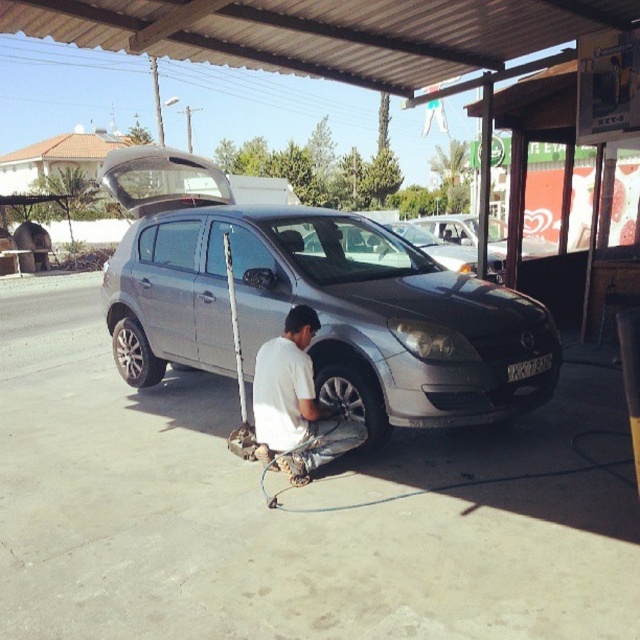
Between satin silver car at center and black plastic license plate at front, which one has less height?

Standing shorter between the two is black plastic license plate at front.

Based on the photo, which is below, satin silver car at center or black plastic license plate at front?

black plastic license plate at front is below.

Where is `satin silver car at center`? This screenshot has height=640, width=640. satin silver car at center is located at coordinates (316, 294).

The width and height of the screenshot is (640, 640). Identify the location of satin silver car at center. (316, 294).

Between black rubber tire at lower center and black plastic license plate at front, which one has less height?

Standing shorter between the two is black plastic license plate at front.

Locate an element on the screen. This screenshot has width=640, height=640. black rubber tire at lower center is located at coordinates (355, 397).

Is white matte shirt at lower center to the right of silver metallic tire at lower left from the viewer's perspective?

Yes, white matte shirt at lower center is to the right of silver metallic tire at lower left.

Is point (308, 458) farther from viewer compared to point (141, 340)?

No, (308, 458) is in front of (141, 340).

The height and width of the screenshot is (640, 640). I want to click on white matte shirt at lower center, so click(x=296, y=404).